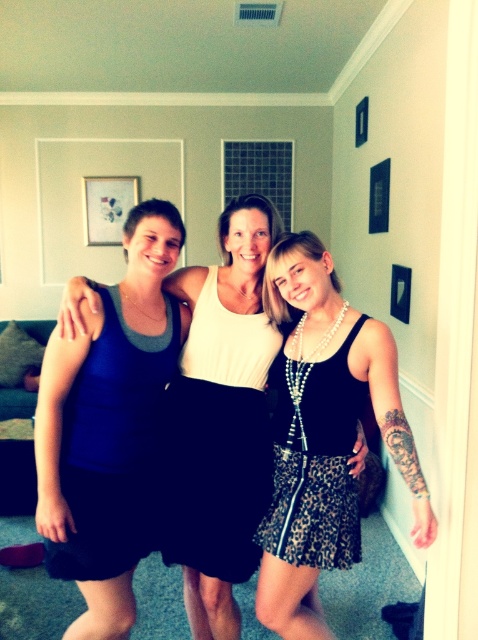
Can you confirm if white matte dress at center is shorter than leopard print skirt at center?

No, white matte dress at center is not shorter than leopard print skirt at center.

Between white matte dress at center and leopard print skirt at center, which one is positioned higher?

white matte dress at center

Does point (161, 547) lie in front of point (326, 488)?

No.

At what (x,y) coordinates should I click in order to perform the action: click on white matte dress at center. Please return your answer as a coordinate pair (x, y). Looking at the image, I should click on (217, 442).

Consider the image. Which of these two, matte blue tank top at left or leopard print skirt at center, stands shorter?

leopard print skirt at center

Which of these two, matte blue tank top at left or leopard print skirt at center, stands taller?

Standing taller between the two is matte blue tank top at left.

Which is behind, point (98, 424) or point (310, 390)?

Positioned behind is point (310, 390).

You are a GUI agent. You are given a task and a screenshot of the screen. Output one action in this format:
    pyautogui.click(x=<x>, y=<y>)
    Task: Click on the matte blue tank top at left
    The width and height of the screenshot is (478, 640).
    Given the screenshot: What is the action you would take?
    pyautogui.click(x=113, y=445)

Can you confirm if white matte dress at center is wider than matte blue tank top at left?

Yes, white matte dress at center is wider than matte blue tank top at left.

Between white matte dress at center and matte blue tank top at left, which one appears on the left side from the viewer's perspective?

From the viewer's perspective, matte blue tank top at left appears more on the left side.

This screenshot has width=478, height=640. What do you see at coordinates (217, 442) in the screenshot?
I see `white matte dress at center` at bounding box center [217, 442].

The height and width of the screenshot is (640, 478). Identify the location of white matte dress at center. (217, 442).